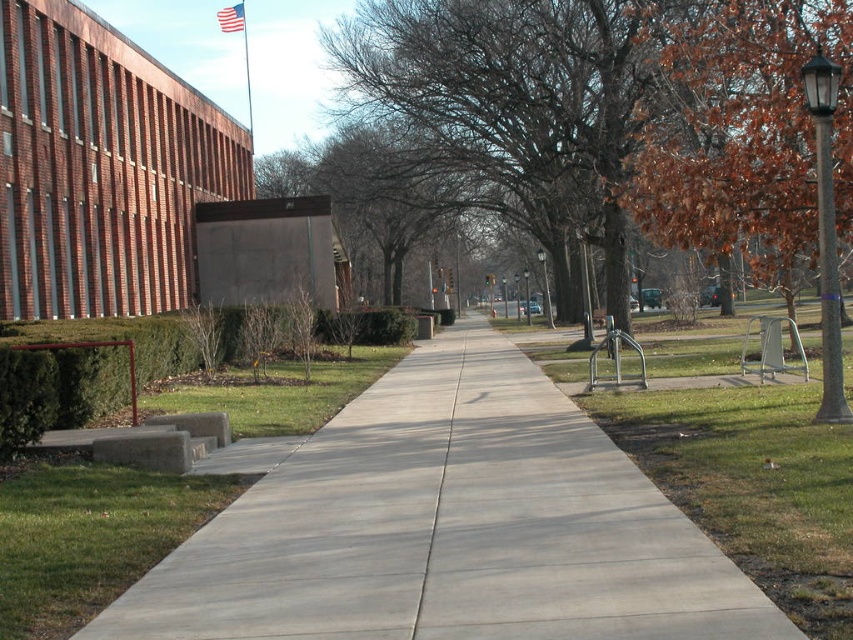
Between gray concrete sidewalk at center and brown leafy tree at right, which one is positioned lower?

gray concrete sidewalk at center

Between point (590, 561) and point (790, 256), which one is positioned in front?

Point (590, 561) is more forward.

The image size is (853, 640). In order to click on gray concrete sidewalk at center in this screenshot , I will do `click(450, 525)`.

Identify the location of gray concrete sidewalk at center. The height and width of the screenshot is (640, 853). (450, 525).